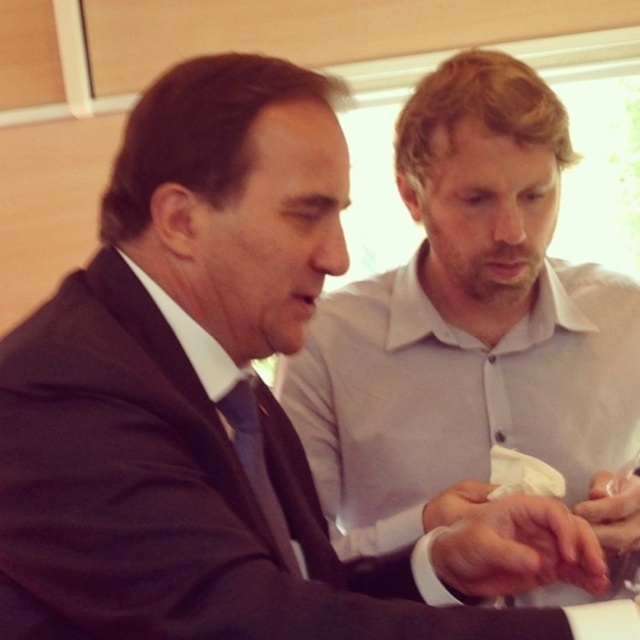
Is white cotton shirt at center smaller than white smooth skin at center?

Incorrect, white cotton shirt at center is not smaller in size than white smooth skin at center.

From the picture: Measure the distance between point (x=474, y=129) and camera.

Point (x=474, y=129) is 96.11 centimeters from camera.

Is point (333, 413) closer to viewer compared to point (598, 548)?

No, (333, 413) is further to viewer.

The width and height of the screenshot is (640, 640). Identify the location of white cotton shirt at center. (467, 321).

Which is more to the left, white cotton shirt at center or translucent plastic cup at center?

white cotton shirt at center is more to the left.

Can you confirm if white cotton shirt at center is positioned above translucent plastic cup at center?

Correct, white cotton shirt at center is located above translucent plastic cup at center.

Who is more forward, (x=492, y=269) or (x=618, y=472)?

Point (x=492, y=269) is more forward.

Locate an element on the screen. The height and width of the screenshot is (640, 640). white cotton shirt at center is located at coordinates (467, 321).

Which of these two, matte blue tie at center or white matte hand at center, stands shorter?

With less height is white matte hand at center.

What do you see at coordinates (257, 464) in the screenshot? This screenshot has width=640, height=640. I see `matte blue tie at center` at bounding box center [257, 464].

The image size is (640, 640). What do you see at coordinates (257, 464) in the screenshot? I see `matte blue tie at center` at bounding box center [257, 464].

Where is `matte blue tie at center`? matte blue tie at center is located at coordinates (257, 464).